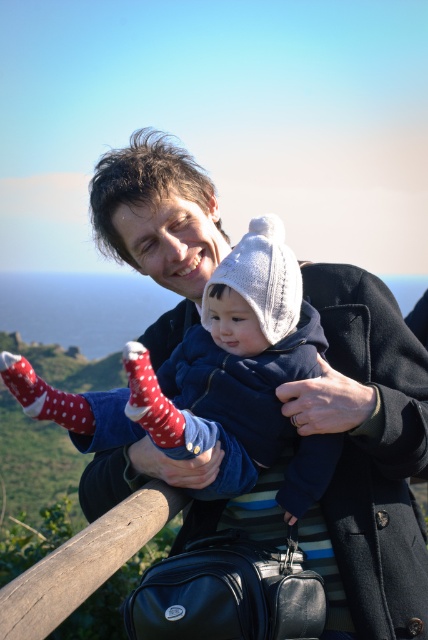
Can you confirm if knitted woolen hat at center is positioned to the left of red dotted socks at center?

Incorrect, knitted woolen hat at center is not on the left side of red dotted socks at center.

Who is more forward, (276, 362) or (145, 404)?

Point (145, 404) is in front.

Which is in front, point (303, 448) or point (151, 392)?

Point (151, 392) is in front.

Locate an element on the screen. The width and height of the screenshot is (428, 640). knitted woolen hat at center is located at coordinates (223, 369).

Can you confirm if knitted woolen hat at center is smaller than red dotted socks at lower left?

Yes, knitted woolen hat at center is smaller than red dotted socks at lower left.

Is knitted woolen hat at center shorter than red dotted socks at lower left?

Incorrect, knitted woolen hat at center's height does not fall short of red dotted socks at lower left's.

Which is in front, point (220, 412) or point (8, 364)?

Positioned in front is point (8, 364).

This screenshot has width=428, height=640. What are the coordinates of `knitted woolen hat at center` in the screenshot? It's located at (223, 369).

Can you confirm if red dotted socks at lower left is taller than red dotted socks at center?

Yes.

Which is in front, point (51, 396) or point (177, 426)?

Positioned in front is point (177, 426).

At what (x,y) coordinates should I click in order to perform the action: click on red dotted socks at lower left. Please return your answer as a coordinate pair (x, y). The width and height of the screenshot is (428, 640). Looking at the image, I should click on (44, 396).